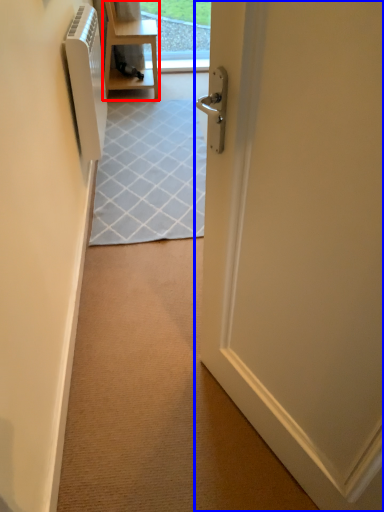
Question: Which object is closer to the camera taking this photo, furniture (highlighted by a red box) or door (highlighted by a blue box)?

Choices:
 (A) furniture
 (B) door

Answer: (B)